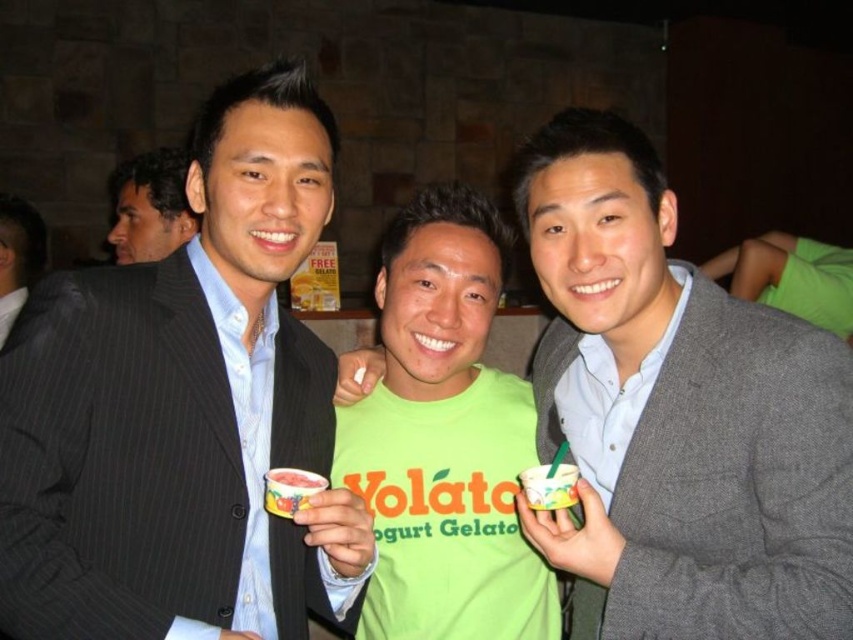
Which is behind, point (331, 157) or point (0, 314)?

The point (0, 314) is more distant.

Can you confirm if matte black suit at center is thinner than light brown suit at left?

No.

Image resolution: width=853 pixels, height=640 pixels. What do you see at coordinates (184, 410) in the screenshot?
I see `matte black suit at center` at bounding box center [184, 410].

Locate an element on the screen. matte black suit at center is located at coordinates (184, 410).

Is green matte shirt at center wider than smooth strawberry yogurt gelato at center?

Correct, the width of green matte shirt at center exceeds that of smooth strawberry yogurt gelato at center.

Is the position of green matte shirt at center more distant than that of smooth strawberry yogurt gelato at center?

Yes.

Where is `green matte shirt at center`? The image size is (853, 640). green matte shirt at center is located at coordinates (444, 438).

Based on the photo, does matte black suit at left have a smaller size compared to white plastic cup at center?

Actually, matte black suit at left might be larger than white plastic cup at center.

Between point (154, 212) and point (563, 472), which one is positioned in front?

Point (563, 472) is more forward.

Does point (154, 161) come in front of point (531, 488)?

No, it is not.

At what (x,y) coordinates should I click in order to perform the action: click on matte black suit at left. Please return your answer as a coordinate pair (x, y). Looking at the image, I should click on (149, 205).